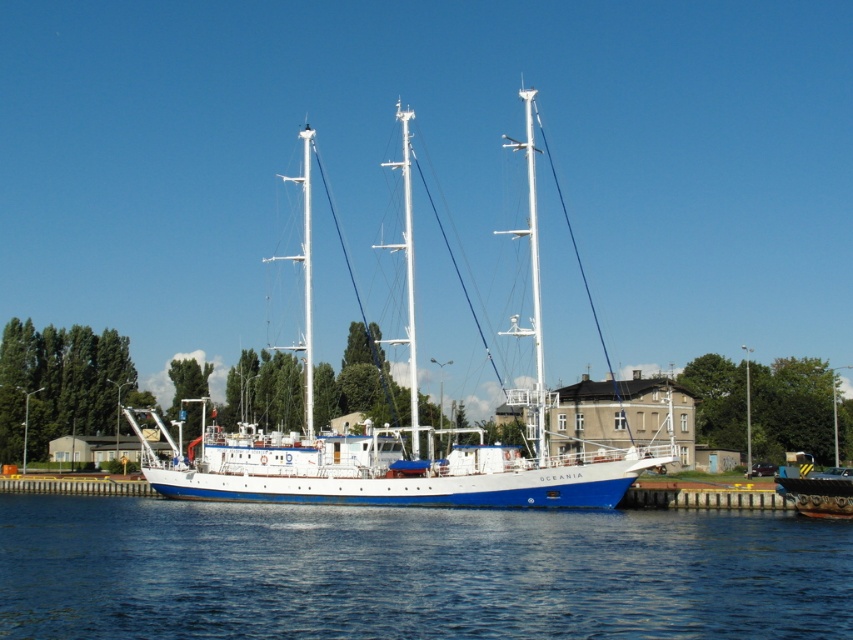
Question: Does blue water at lower center appear on the right side of blue matte boat at lower right?

Choices:
 (A) yes
 (B) no

Answer: (B)

Question: Is blue water at lower center thinner than blue matte boat at lower right?

Choices:
 (A) yes
 (B) no

Answer: (B)

Question: Estimate the real-world distances between objects in this image. Which object is farther from the blue water at lower center?

Choices:
 (A) white matte sailboat at center
 (B) blue matte boat at lower right

Answer: (A)

Question: Which point is farther to the camera?

Choices:
 (A) blue water at lower center
 (B) white matte sailboat at center
 (C) blue matte boat at lower right

Answer: (C)

Question: Can you confirm if blue water at lower center is positioned below blue matte boat at lower right?

Choices:
 (A) no
 (B) yes

Answer: (A)

Question: Which object is farther from the camera taking this photo?

Choices:
 (A) blue matte boat at lower right
 (B) white matte sailboat at center
 (C) blue water at lower center

Answer: (A)